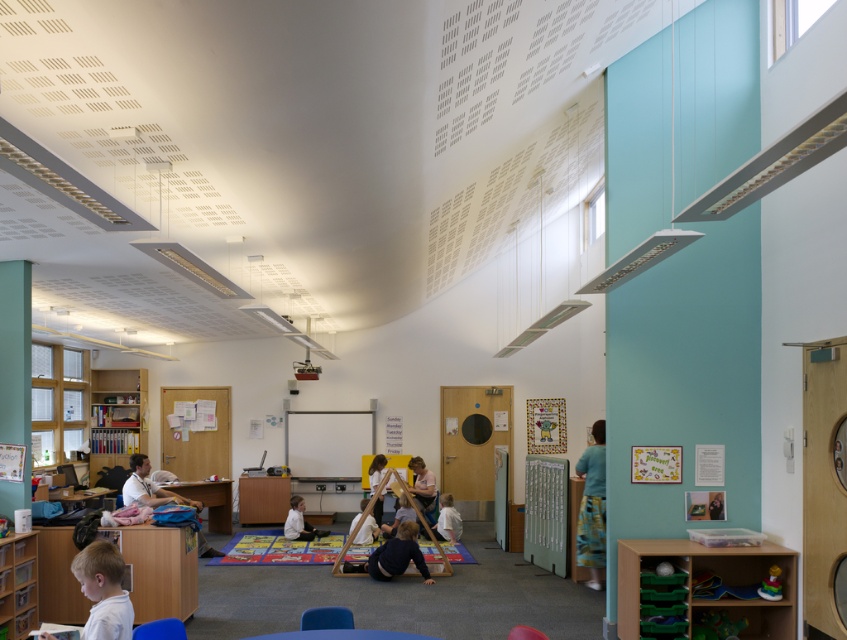
Between white fabric student at center and white fabric at center, which one is positioned lower?

white fabric student at center is below.

What are the coordinates of `white fabric student at center` in the screenshot? It's located at (299, 522).

Which is in front, point (768, 632) or point (97, 456)?

Positioned in front is point (768, 632).

Locate an element on the screen. wooden toy storage at lower right is located at coordinates (713, 579).

Does wooden toy storage at lower right have a lesser height compared to rubberized plastic chair at lower center?

In fact, wooden toy storage at lower right may be taller than rubberized plastic chair at lower center.

Measure the distance between wooden toy storage at lower right and camera.

A distance of 4.91 meters exists between wooden toy storage at lower right and camera.

At what (x,y) coordinates should I click in order to perform the action: click on wooden toy storage at lower right. Please return your answer as a coordinate pair (x, y). The height and width of the screenshot is (640, 847). Looking at the image, I should click on (713, 579).